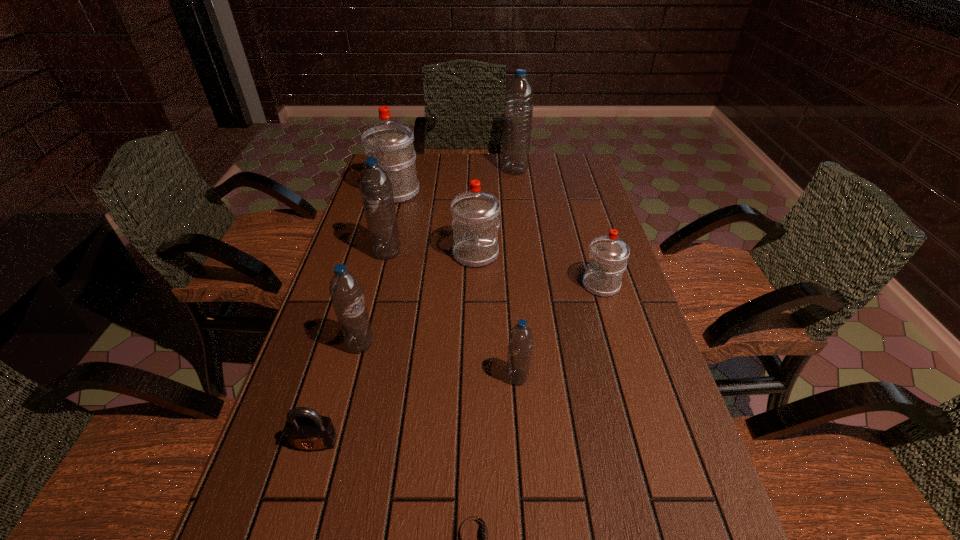
Locate an element on the screen. The image size is (960, 540). water bottle that is the third closest to the third biggest blue water bottle is located at coordinates (520, 342).

Image resolution: width=960 pixels, height=540 pixels. Find the location of `water bottle that stands as the sixth closest to the third nearest object`. water bottle that stands as the sixth closest to the third nearest object is located at coordinates (518, 108).

Identify the location of blue water bottle that is the second nearest to the second smallest blue water bottle. (520, 342).

Choose which blue water bottle is the nearest neighbor to the fourth water bottle from right to left. Please provide its 2D coordinates. Your answer should be formatted as a tuple, i.e. [(x, y)], where the tuple contains the x and y coordinates of a point satisfying the conditions above.

[(376, 189)]

Point out which white water bottle is positioned as the nearest to the nearest white water bottle. Please provide its 2D coordinates. Your answer should be formatted as a tuple, i.e. [(x, y)], where the tuple contains the x and y coordinates of a point satisfying the conditions above.

[(475, 222)]

I want to click on white water bottle object that ranks as the second closest to the nearest white water bottle, so click(392, 142).

Where is `vacant space that satisfies the following two spatial constraints: 1. on the handle side of the biggest white water bottle; 2. on the back side of the third smallest blue water bottle`? vacant space that satisfies the following two spatial constraints: 1. on the handle side of the biggest white water bottle; 2. on the back side of the third smallest blue water bottle is located at coordinates (379, 253).

Where is `free space that satisfies the following two spatial constraints: 1. on the handle side of the nearest water bottle; 2. on the left side of the second biggest white water bottle`? Image resolution: width=960 pixels, height=540 pixels. free space that satisfies the following two spatial constraints: 1. on the handle side of the nearest water bottle; 2. on the left side of the second biggest white water bottle is located at coordinates (474, 377).

You are a GUI agent. You are given a task and a screenshot of the screen. Output one action in this format:
    pyautogui.click(x=<x>, y=<y>)
    Task: Click on the free space that satisfies the following two spatial constraints: 1. on the handle side of the nearest water bottle; 2. on the left side of the second biggest white water bottle
    Image resolution: width=960 pixels, height=540 pixels.
    Given the screenshot: What is the action you would take?
    pyautogui.click(x=474, y=377)

Where is `blank space that satisfies the following two spatial constraints: 1. on the back side of the second nearest blue water bottle; 2. on the handle side of the biggest white water bottle`? This screenshot has height=540, width=960. blank space that satisfies the following two spatial constraints: 1. on the back side of the second nearest blue water bottle; 2. on the handle side of the biggest white water bottle is located at coordinates (399, 192).